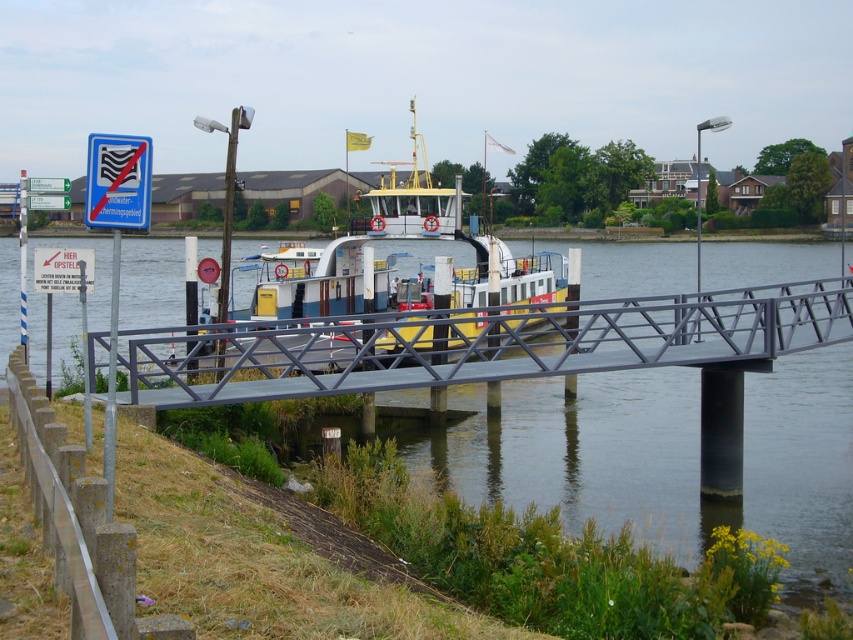
Question: Does metallic gray bridge at lower center appear under yellow painted metal ferry at center?

Choices:
 (A) no
 (B) yes

Answer: (B)

Question: Does metallic gray bridge at lower center appear on the left side of yellow painted metal ferry at center?

Choices:
 (A) yes
 (B) no

Answer: (B)

Question: Does metallic gray bridge at lower center appear over yellow painted metal ferry at center?

Choices:
 (A) yes
 (B) no

Answer: (B)

Question: Which point is farther from the camera taking this photo?

Choices:
 (A) (408, 307)
 (B) (564, 339)

Answer: (A)

Question: Which object is farther from the camera taking this photo?

Choices:
 (A) yellow painted metal ferry at center
 (B) metallic gray bridge at lower center

Answer: (A)